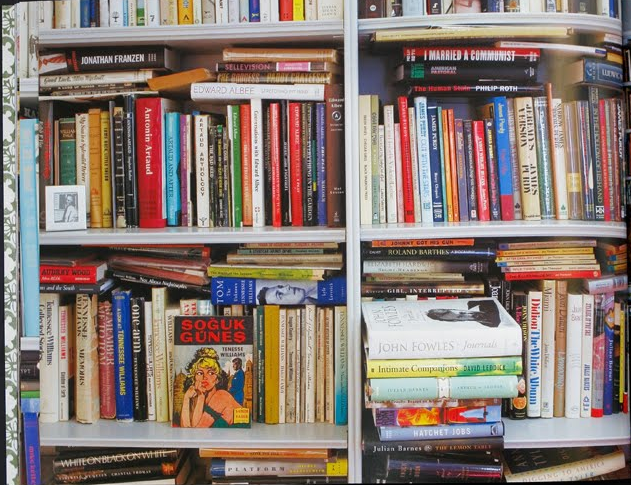
The width and height of the screenshot is (631, 485). Identify the location of wooden planks on shelf. click(304, 233), click(410, 230), click(572, 428), click(236, 436), click(326, 33), click(404, 20).